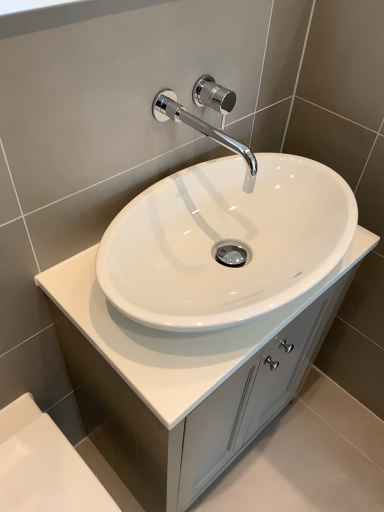
Question: From a real-world perspective, does polished chrome faucet at upper center stand above white glossy cabinet at center?

Choices:
 (A) yes
 (B) no

Answer: (A)

Question: Is polished chrome faucet at upper center smaller than white glossy cabinet at center?

Choices:
 (A) no
 (B) yes

Answer: (B)

Question: Is polished chrome faucet at upper center positioned with its back to white glossy cabinet at center?

Choices:
 (A) no
 (B) yes

Answer: (A)

Question: Is polished chrome faucet at upper center touching white glossy cabinet at center?

Choices:
 (A) yes
 (B) no

Answer: (B)

Question: Is polished chrome faucet at upper center to the left of white glossy cabinet at center from the viewer's perspective?

Choices:
 (A) no
 (B) yes

Answer: (B)

Question: Based on their positions, is white glossy bath at lower left located to the left or right of chrome/polished metal faucet at upper center?

Choices:
 (A) right
 (B) left

Answer: (B)

Question: Considering the positions of white glossy bath at lower left and chrome/polished metal faucet at upper center in the image, is white glossy bath at lower left taller or shorter than chrome/polished metal faucet at upper center?

Choices:
 (A) tall
 (B) short

Answer: (A)

Question: From the image's perspective, is white glossy bath at lower left positioned above or below chrome/polished metal faucet at upper center?

Choices:
 (A) above
 (B) below

Answer: (B)

Question: Is white glossy bath at lower left wider or thinner than chrome/polished metal faucet at upper center?

Choices:
 (A) thin
 (B) wide

Answer: (B)

Question: In the image, is chrome/polished metal faucet at upper center on the left side or the right side of polished chrome faucet at upper center?

Choices:
 (A) left
 (B) right

Answer: (A)

Question: Based on their sizes in the image, would you say chrome/polished metal faucet at upper center is bigger or smaller than polished chrome faucet at upper center?

Choices:
 (A) small
 (B) big

Answer: (B)

Question: Considering their positions, is chrome/polished metal faucet at upper center located in front of or behind polished chrome faucet at upper center?

Choices:
 (A) front
 (B) behind

Answer: (A)

Question: From their relative heights in the image, would you say chrome/polished metal faucet at upper center is taller or shorter than polished chrome faucet at upper center?

Choices:
 (A) tall
 (B) short

Answer: (B)

Question: Would you say polished chrome faucet at upper center is to the left or to the right of white glossy bath at lower left in the picture?

Choices:
 (A) right
 (B) left

Answer: (A)

Question: Considering the positions of point (198, 99) and point (26, 423), is point (198, 99) closer or farther from the camera than point (26, 423)?

Choices:
 (A) closer
 (B) farther

Answer: (A)